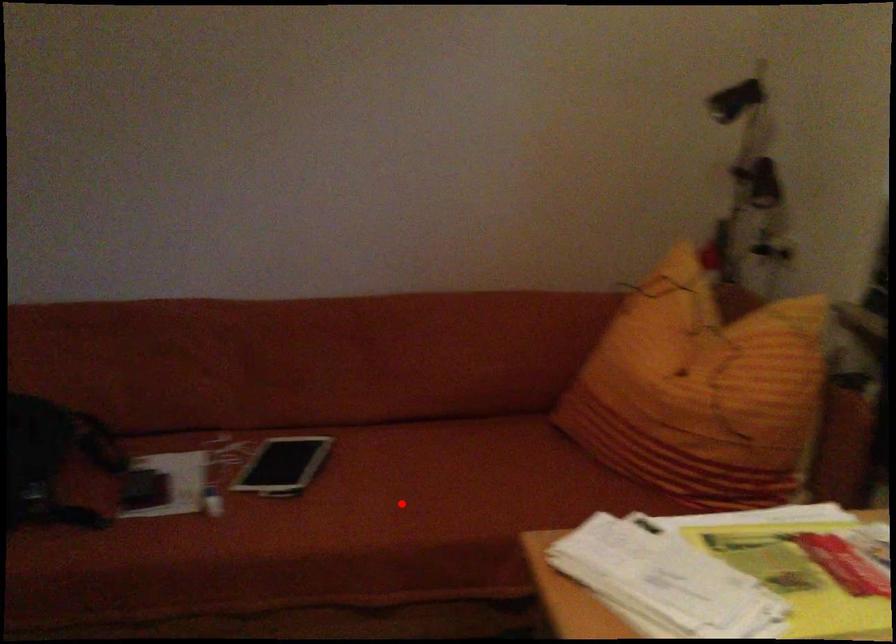
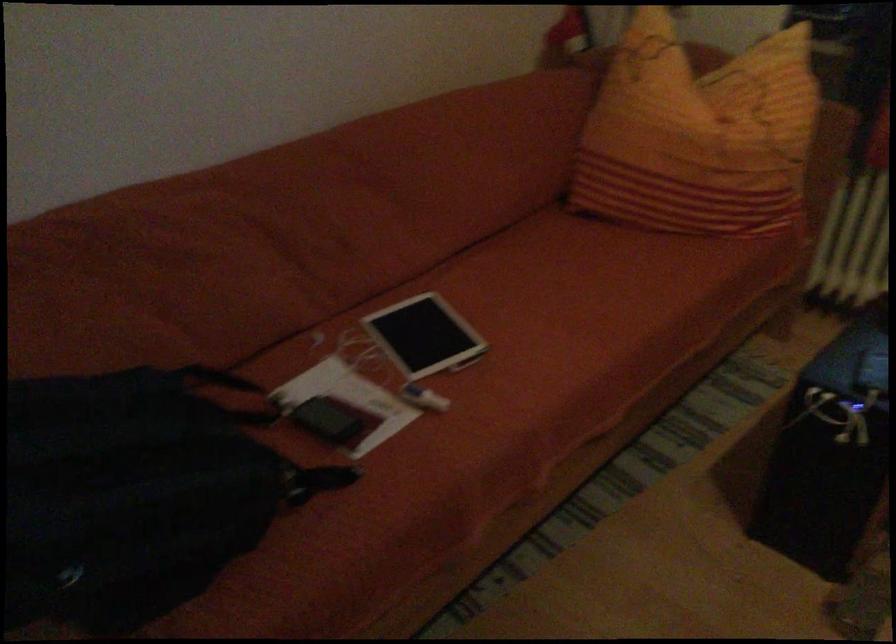
Locate, in the second image, the point that corresponds to the highlighted location in the first image.

(574, 323)